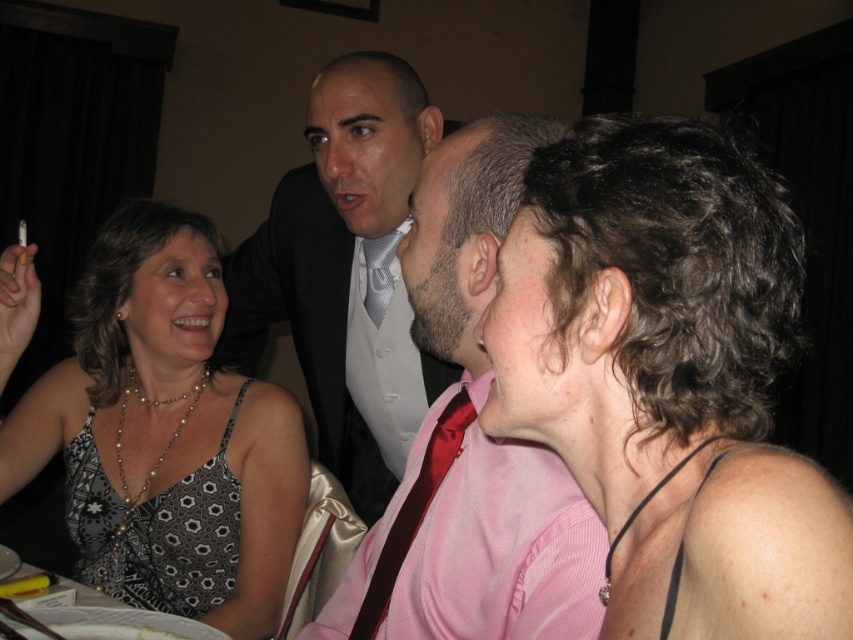
Question: Which point is closer to the camera taking this photo?

Choices:
 (A) (112, 362)
 (B) (379, 285)
 (C) (194, 474)
 (D) (415, 93)

Answer: (D)

Question: Does patterned fabric dress at left have a greater width compared to white textured dress shirt at center?

Choices:
 (A) no
 (B) yes

Answer: (B)

Question: Is dark curly hair at upper right below matte black suit at center?

Choices:
 (A) yes
 (B) no

Answer: (B)

Question: Based on their relative distances, which object is nearer to the silver textured tie at center?

Choices:
 (A) shiny red tie at center
 (B) shiny black suit at center
 (C) dark curly hair at upper right
 (D) black printed fabric dress at lower left

Answer: (B)

Question: Which point is farther to the camera?

Choices:
 (A) (772, 289)
 (B) (426, 448)
 (C) (281, 211)

Answer: (C)

Question: Is patterned fabric dress at left above shiny black suit at center?

Choices:
 (A) no
 (B) yes

Answer: (A)